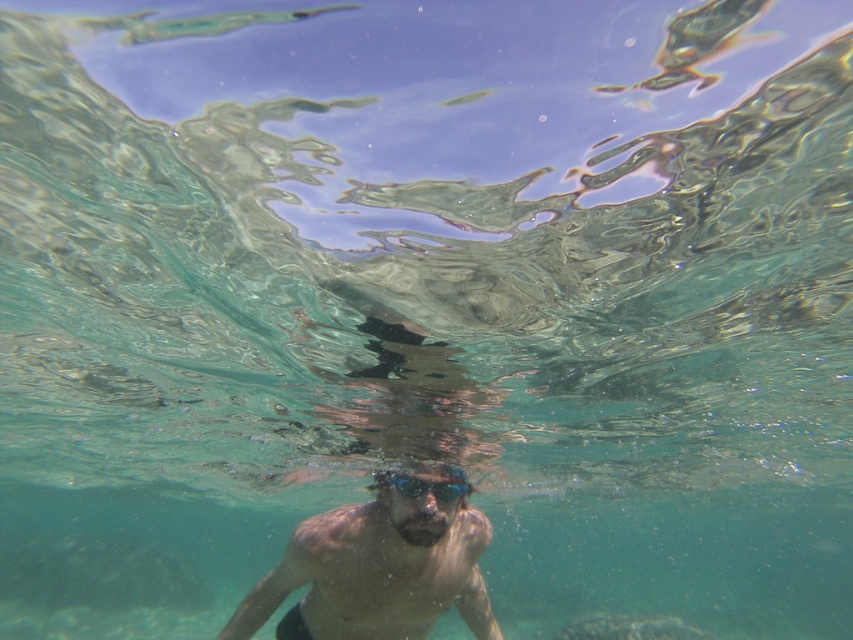
Question: Is smooth skin man at center below transparent plastic goggles at center?

Choices:
 (A) yes
 (B) no

Answer: (A)

Question: Among these objects, which one is farthest from the camera?

Choices:
 (A) transparent plastic goggles at center
 (B) smooth skin man at center

Answer: (A)

Question: Can you confirm if smooth skin man at center is positioned to the left of transparent plastic goggles at center?

Choices:
 (A) no
 (B) yes

Answer: (B)

Question: Which point appears farthest from the camera in this image?

Choices:
 (A) (428, 490)
 (B) (360, 580)

Answer: (A)

Question: Is smooth skin man at center positioned before transparent plastic goggles at center?

Choices:
 (A) yes
 (B) no

Answer: (A)